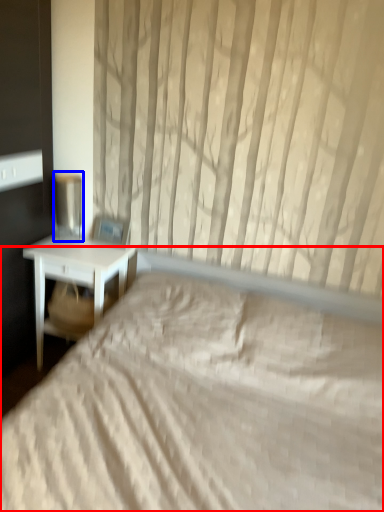
Question: Which of the following is the closest to the observer, bed (highlighted by a red box) or table lamp (highlighted by a blue box)?

Choices:
 (A) bed
 (B) table lamp

Answer: (A)